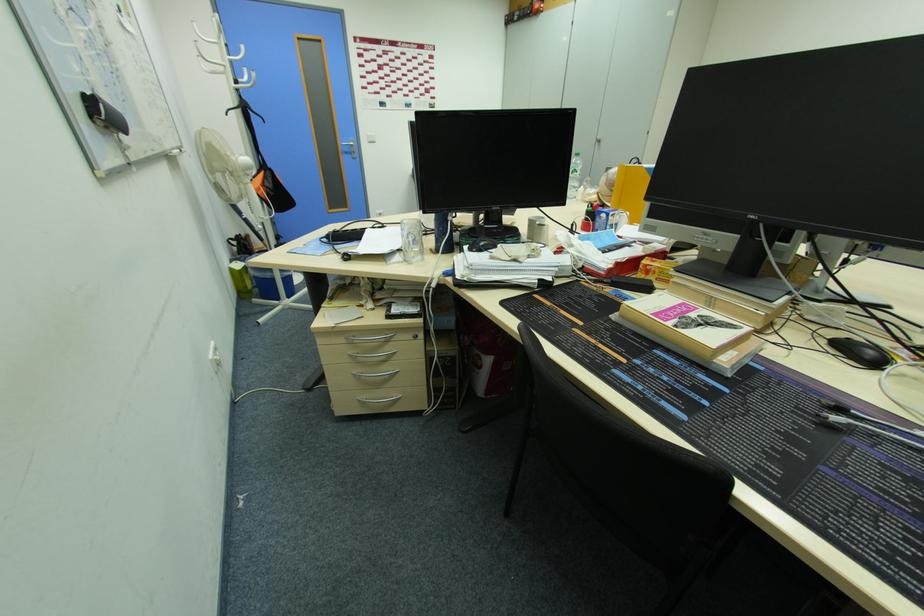
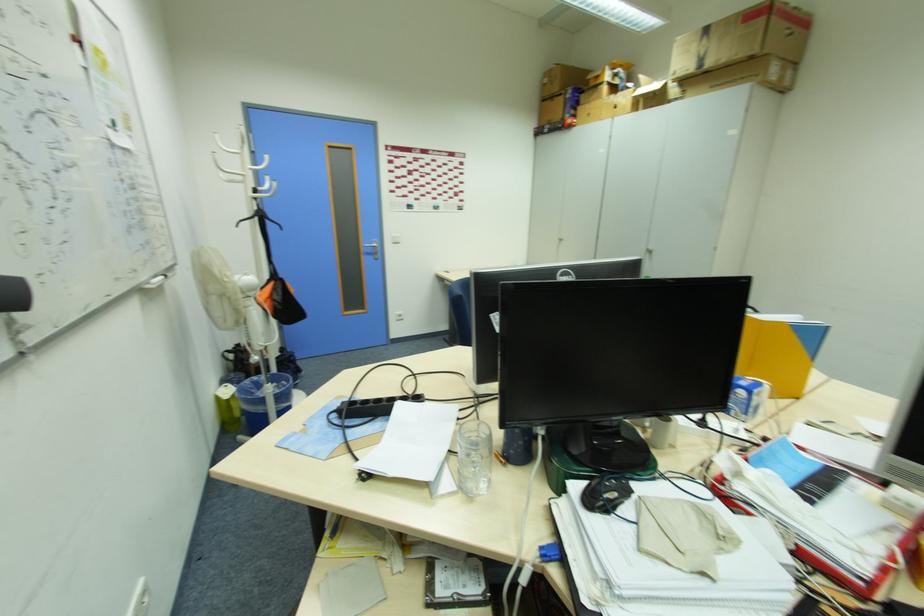
Find the pixel in the second image that matches point (257, 257) in the first image.

(249, 383)